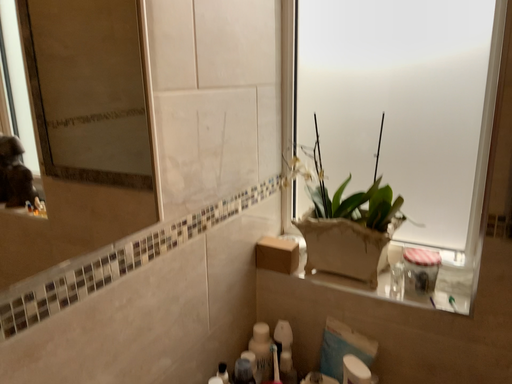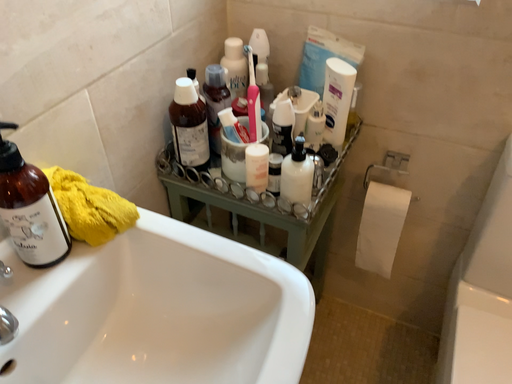
Question: Which way did the camera rotate in the video?

Choices:
 (A) rotated upward
 (B) rotated downward

Answer: (B)